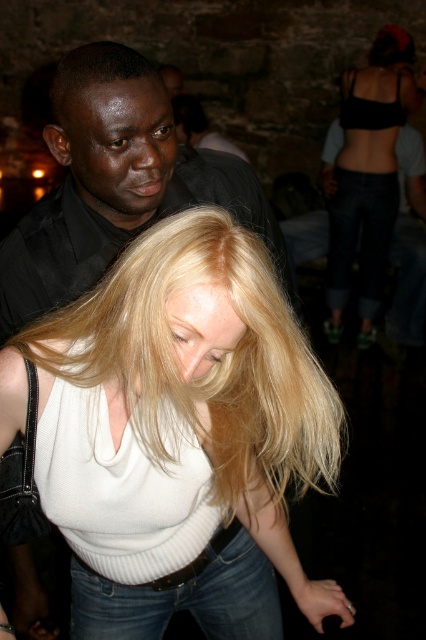
You are at a party and see two black matte tops in the crowd. The black matte shirt at upper left and the black matte tank top at upper right. Which one is smaller?

The black matte shirt at upper left is smaller than the black matte tank top at upper right.

You are a photographer at the event and need to capture a photo that includes both the black matte shirt at upper left and the black matte tank top at upper right. The camera you are using has a maximum focus range of 3 meters. Will you be able to capture both subjects in focus without moving the camera?

The distance between the black matte shirt at upper left and the black matte tank top at upper right is 3.07 meters. Since the camera can only focus up to 3 meters, the subjects are slightly beyond the focus range. Therefore, you won not be able to capture both in focus without adjusting the camera position or settings.

You are at a party and see a woman wearing a white knitwear at center and denim jeans at lower center. Which item of clothing is nearer to you?

The white knitwear at center is closer to the viewer than the denim jeans at lower center.